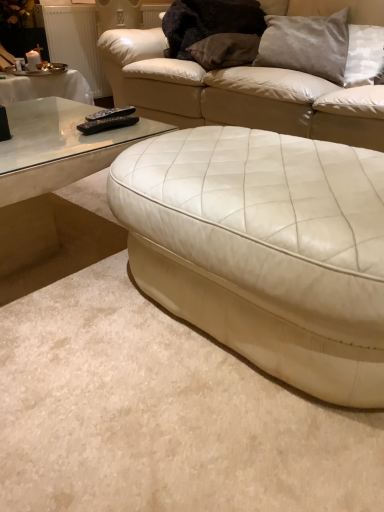
This screenshot has height=512, width=384. Find the location of `vacant space in front of black plastic remote at left, the 1th remote positioned from the front`. vacant space in front of black plastic remote at left, the 1th remote positioned from the front is located at coordinates (90, 143).